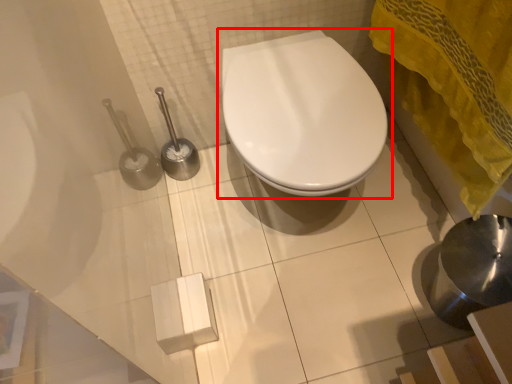
Question: From the image's perspective, where is toilet (annotated by the red box) located in relation to bath towel in the image?

Choices:
 (A) below
 (B) above

Answer: (A)